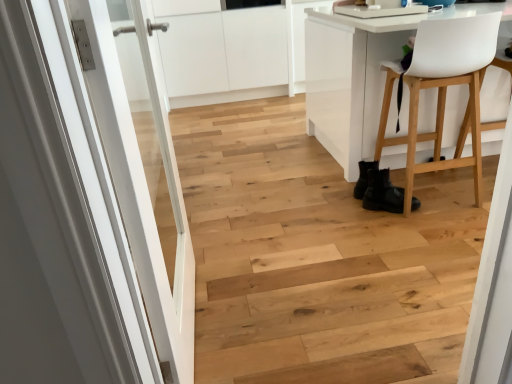
Question: Can you confirm if white glossy door at left is positioned to the left of white plastic chair at right?

Choices:
 (A) yes
 (B) no

Answer: (A)

Question: Does white glossy door at left have a lesser height compared to white plastic chair at right?

Choices:
 (A) no
 (B) yes

Answer: (A)

Question: Could you tell me if white glossy door at left is facing white plastic chair at right?

Choices:
 (A) yes
 (B) no

Answer: (A)

Question: Is white glossy door at left oriented away from white plastic chair at right?

Choices:
 (A) yes
 (B) no

Answer: (B)

Question: Does white glossy door at left come behind white plastic chair at right?

Choices:
 (A) yes
 (B) no

Answer: (B)

Question: Does point (382, 173) appear closer or farther from the camera than point (105, 122)?

Choices:
 (A) farther
 (B) closer

Answer: (A)

Question: Is black leather boots at lower right wider or thinner than white glossy door at left?

Choices:
 (A) wide
 (B) thin

Answer: (A)

Question: Based on their positions, is black leather boots at lower right located to the left or right of white glossy door at left?

Choices:
 (A) right
 (B) left

Answer: (A)

Question: From a real-world perspective, is black leather boots at lower right above or below white glossy door at left?

Choices:
 (A) below
 (B) above

Answer: (A)

Question: From a real-world perspective, is white glossy door at left above or below black leather boots at lower right?

Choices:
 (A) below
 (B) above

Answer: (B)

Question: In terms of size, does white glossy door at left appear bigger or smaller than black leather boots at lower right?

Choices:
 (A) small
 (B) big

Answer: (B)

Question: In the image, is white glossy door at left positioned in front of or behind black leather boots at lower right?

Choices:
 (A) behind
 (B) front

Answer: (B)

Question: Visually, is white glossy door at left positioned to the left or to the right of black leather boots at lower right?

Choices:
 (A) left
 (B) right

Answer: (A)

Question: In terms of height, does white plastic chair at right look taller or shorter compared to black leather boots at lower right?

Choices:
 (A) tall
 (B) short

Answer: (A)

Question: Based on their sizes in the image, would you say white plastic chair at right is bigger or smaller than black leather boots at lower right?

Choices:
 (A) big
 (B) small

Answer: (A)